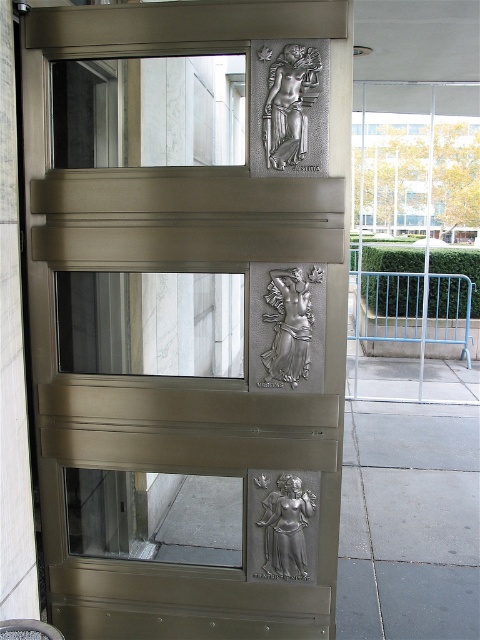
Is gray concrete pavement at lower right smaller than silver metallic relief at lower center?

No.

Consider the image. Which of these two, gray concrete pavement at lower right or silver metallic relief at lower center, stands taller?

Standing taller between the two is gray concrete pavement at lower right.

Where is `gray concrete pavement at lower right`? gray concrete pavement at lower right is located at coordinates (408, 522).

Does gray concrete pavement at lower right have a smaller size compared to silver metallic relief at upper center?

Incorrect, gray concrete pavement at lower right is not smaller in size than silver metallic relief at upper center.

Is point (394, 483) less distant than point (296, 144)?

No, (394, 483) is further to viewer.

Is point (356, 582) positioned behind point (294, 61)?

Yes, it is.

In order to click on gray concrete pavement at lower right in this screenshot , I will do `click(408, 522)`.

Which of these two, silver metallic relief at upper center or silver metallic relief at center-right, stands shorter?

silver metallic relief at upper center

Does point (301, 131) lie in front of point (285, 349)?

That is True.

At what (x,y) coordinates should I click in order to perform the action: click on silver metallic relief at upper center. Please return your answer as a coordinate pair (x, y). This screenshot has width=480, height=640. Looking at the image, I should click on (288, 104).